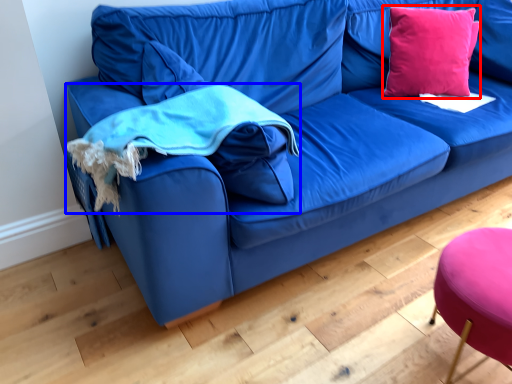
Question: Which object appears closest to the camera in this image, throw pillow (highlighted by a red box) or cloth (highlighted by a blue box)?

Choices:
 (A) throw pillow
 (B) cloth

Answer: (B)